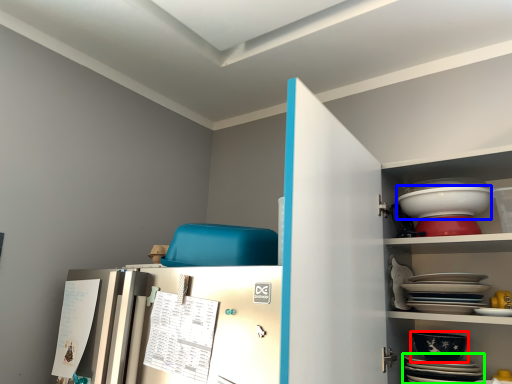
Question: Which is farther away from bowl (highlighted by a red box)? bowl (highlighted by a blue box) or platter (highlighted by a green box)?

Choices:
 (A) bowl
 (B) platter

Answer: (A)